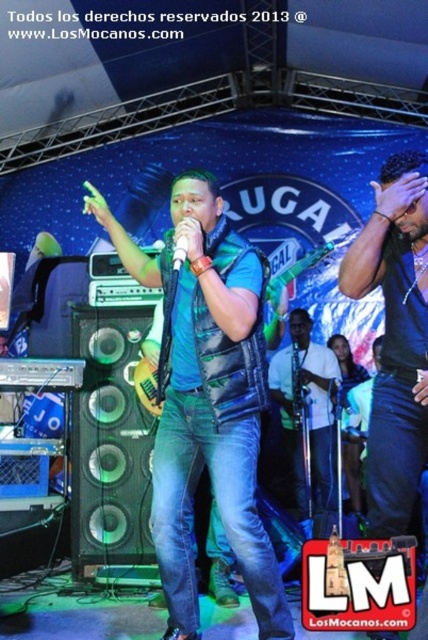
Who is more distant from viewer, [264,275] or [178,237]?

Point [264,275]

Does blue leather vest at center have a larger size compared to white plastic microphone at center?

Yes.

The image size is (428, 640). Describe the element at coordinates (208, 401) in the screenshot. I see `blue leather vest at center` at that location.

This screenshot has width=428, height=640. Find the location of `blue leather vest at center`. blue leather vest at center is located at coordinates (208, 401).

Who is positioned more to the right, blue leather vest at center or white matte shirt at center?

From the viewer's perspective, white matte shirt at center appears more on the right side.

What do you see at coordinates (208, 401) in the screenshot? The height and width of the screenshot is (640, 428). I see `blue leather vest at center` at bounding box center [208, 401].

Locate an element on the screen. blue leather vest at center is located at coordinates (208, 401).

Between white matte shirt at center and white plastic microphone at center, which one is positioned lower?

white matte shirt at center is lower down.

Does point (332, 376) come behind point (178, 244)?

Yes, point (332, 376) is farther from viewer.

The width and height of the screenshot is (428, 640). Find the location of `white matte shirt at center`. white matte shirt at center is located at coordinates (318, 417).